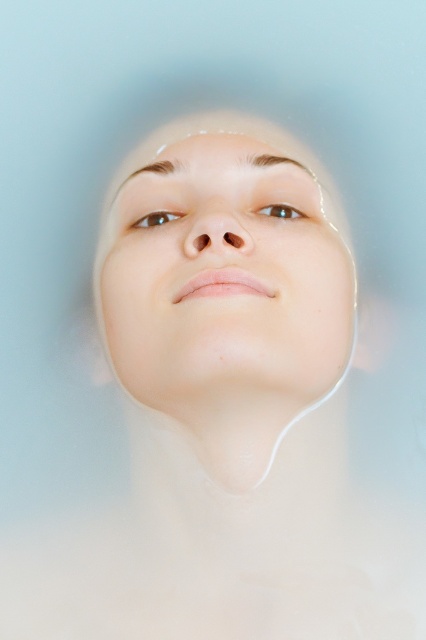
Question: Does brown matte eye at upper center appear on the right side of brown glossy eye at center?

Choices:
 (A) yes
 (B) no

Answer: (B)

Question: Which of the following is the farthest from the observer?

Choices:
 (A) smooth skin face at center
 (B) brown glossy eye at center

Answer: (B)

Question: Where is smooth skin face at center located in relation to brown matte eye at upper center in the image?

Choices:
 (A) below
 (B) above

Answer: (A)

Question: Estimate the real-world distances between objects in this image. Which object is closer to the brown matte eye at upper center?

Choices:
 (A) brown glossy eye at center
 (B) smooth skin face at center

Answer: (A)

Question: Does smooth skin face at center appear on the right side of brown glossy eye at center?

Choices:
 (A) yes
 (B) no

Answer: (B)

Question: Based on their relative distances, which object is farther from the brown glossy eye at center?

Choices:
 (A) brown matte eye at upper center
 (B) smooth skin face at center

Answer: (B)